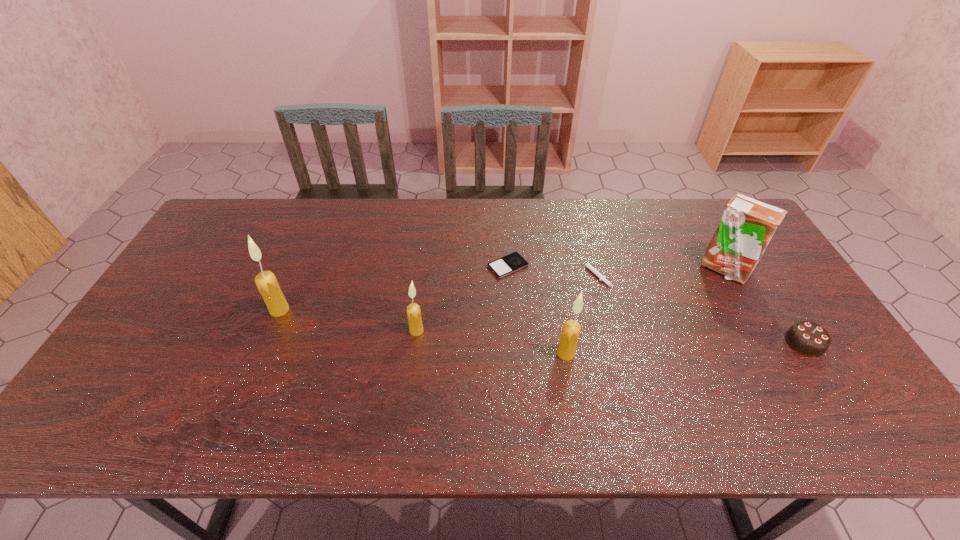
The height and width of the screenshot is (540, 960). Identify the location of blank space that satisfies the following two spatial constraints: 1. on the front side of the fourth farthest object; 2. on the left side of the fourth tallest object. (x=271, y=330).

You are a GUI agent. You are given a task and a screenshot of the screen. Output one action in this format:
    pyautogui.click(x=<x>, y=<y>)
    Task: Click on the free location that satisfies the following two spatial constraints: 1. on the straw side of the carton; 2. on the right side of the third shortest object
    
    Given the screenshot: What is the action you would take?
    pyautogui.click(x=766, y=343)